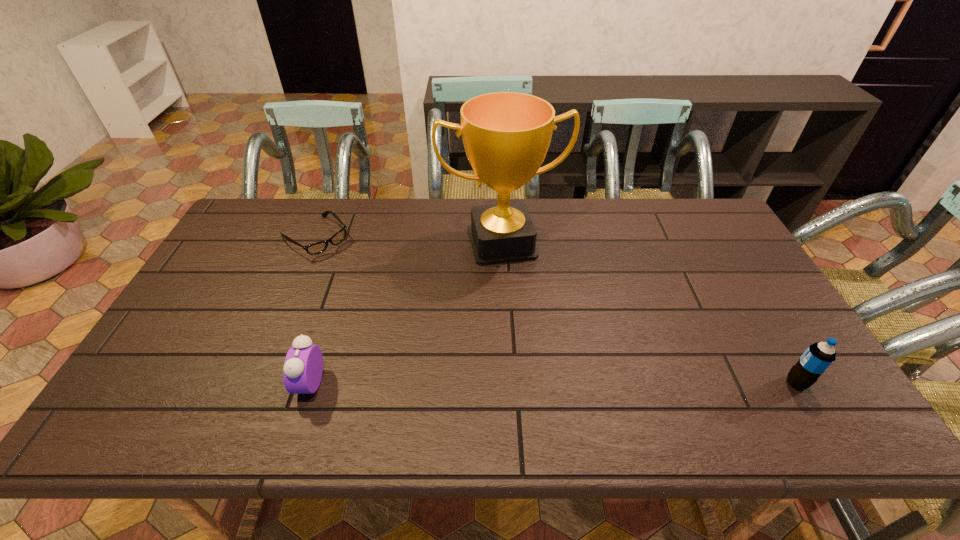
The width and height of the screenshot is (960, 540). What are the coordinates of `alarm clock` in the screenshot? It's located at (303, 367).

This screenshot has width=960, height=540. Find the location of `the rightmost object`. the rightmost object is located at coordinates (818, 357).

Image resolution: width=960 pixels, height=540 pixels. I want to click on soda bottle, so [x=818, y=357].

This screenshot has width=960, height=540. What are the coordinates of `the tallest object` in the screenshot? It's located at (506, 135).

You are a GUI agent. You are given a task and a screenshot of the screen. Output one action in this format:
    pyautogui.click(x=<x>, y=<y>)
    Task: Click on the third object from left to right
    This screenshot has height=540, width=960.
    Given the screenshot: What is the action you would take?
    pyautogui.click(x=506, y=135)

Where is `the shortest object`? This screenshot has height=540, width=960. the shortest object is located at coordinates (319, 247).

This screenshot has width=960, height=540. I want to click on vacant area located 0.380m on the face of the alarm clock, so click(140, 382).

Locate an element on the screen. The image size is (960, 540). vacant space situated 0.360m on the face of the alarm clock is located at coordinates (149, 382).

The image size is (960, 540). I want to click on vacant region located 0.380m on the face of the alarm clock, so click(x=140, y=382).

Where is `free location located on the left of the third shortest object`? Image resolution: width=960 pixels, height=540 pixels. free location located on the left of the third shortest object is located at coordinates (709, 383).